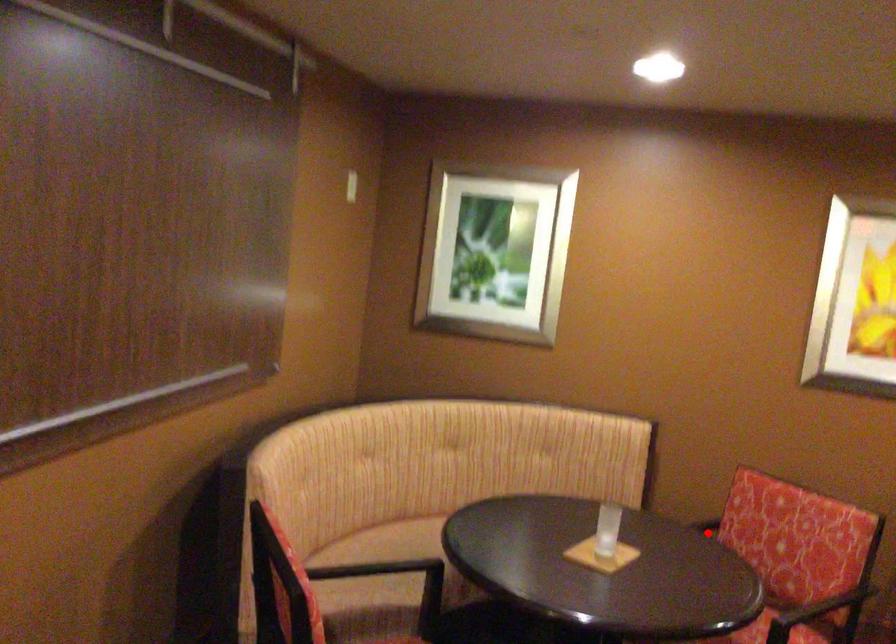
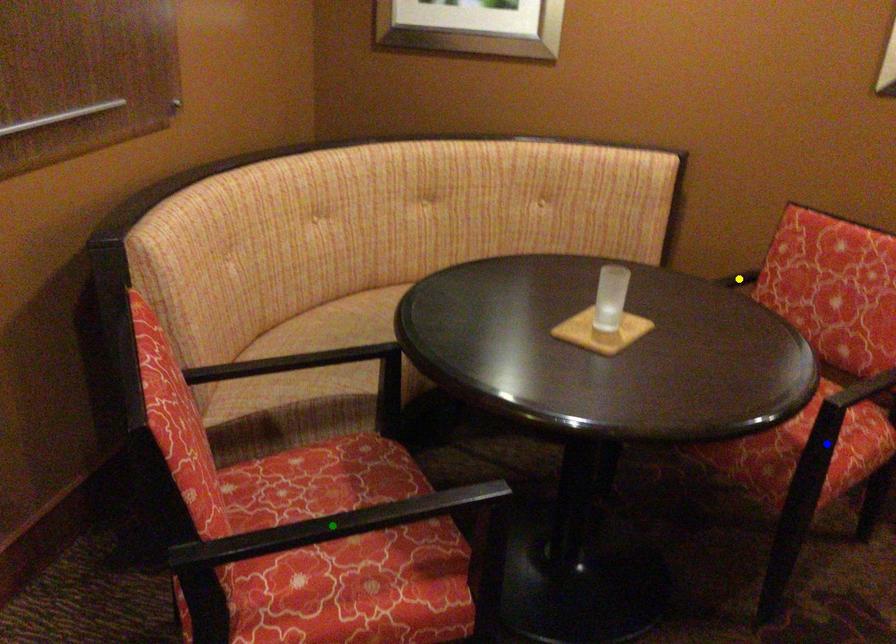
Question: I am providing you with two images of the same scene from different viewpoints. A red point is marked on the first image. You are given multiple points on the second image. In image 2, which mark is for the same physical point as the one in image 1?

Choices:
 (A) green point
 (B) blue point
 (C) yellow point

Answer: (C)